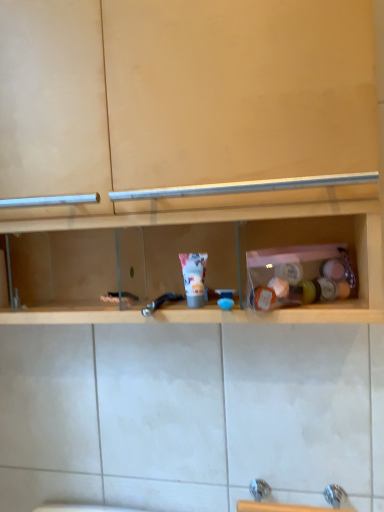
Question: From their relative heights in the image, would you say wooden shelf at center is taller or shorter than metallic blue faucet at center?

Choices:
 (A) short
 (B) tall

Answer: (B)

Question: Is wooden shelf at center to the left or to the right of metallic blue faucet at center in the image?

Choices:
 (A) right
 (B) left

Answer: (B)

Question: Estimate the real-world distances between objects in this image. Which object is farther from the metallic blue faucet at center?

Choices:
 (A) white matte tube at center
 (B) wooden shelf at center

Answer: (B)

Question: Which of these objects is positioned farthest from the white matte tube at center?

Choices:
 (A) metallic blue faucet at center
 (B) wooden shelf at center

Answer: (B)